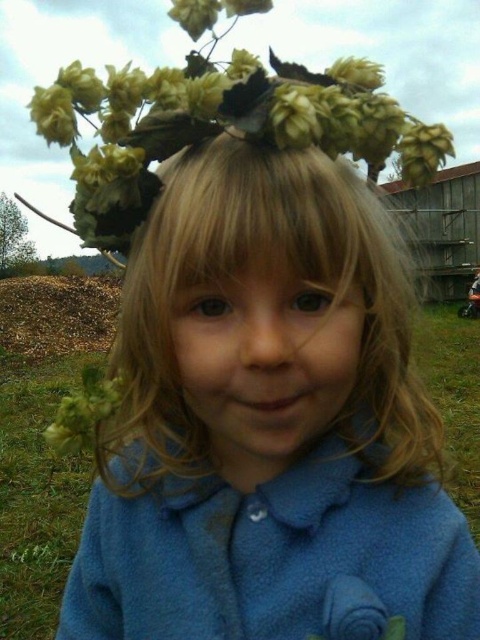
Question: Which of the following is the closest to the observer?

Choices:
 (A) (345, 177)
 (B) (327, 620)
 (C) (369, 298)

Answer: (B)

Question: Which object is closer to the camera taking this photo?

Choices:
 (A) blue fleece head at center
 (B) blue fleece jacket at center

Answer: (A)

Question: Which object appears closest to the camera in this image?

Choices:
 (A) green matte flower at upper center
 (B) blue fleece jacket at center

Answer: (B)

Question: Is blue fleece jacket at center positioned before blue fleece head at center?

Choices:
 (A) yes
 (B) no

Answer: (B)

Question: Does blue fleece jacket at center have a lesser width compared to green matte flower at upper center?

Choices:
 (A) no
 (B) yes

Answer: (B)

Question: Is blue fleece jacket at center to the left of green matte flower at upper center from the viewer's perspective?

Choices:
 (A) no
 (B) yes

Answer: (A)